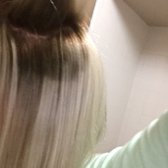
Find the location of a particular element. cabinet is located at coordinates (89, 74).